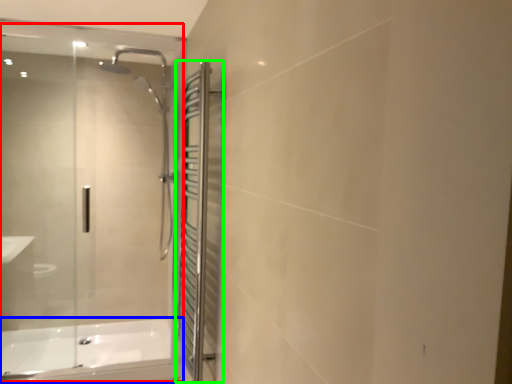
Question: Which object is the farthest from glass door (highlighted by a red box)? Choose among these: bathtub (highlighted by a blue box) or screen door (highlighted by a green box).

Choices:
 (A) bathtub
 (B) screen door

Answer: (B)